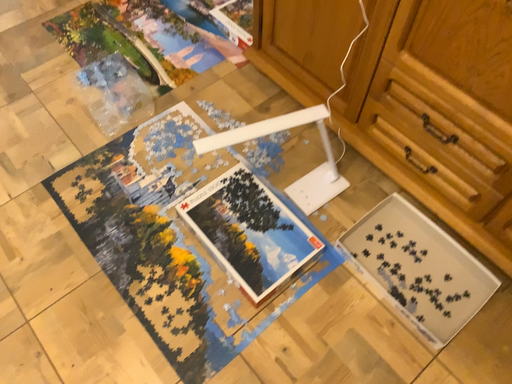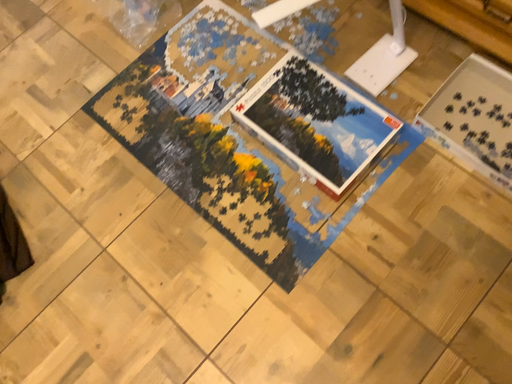
Question: Which way did the camera rotate in the video?

Choices:
 (A) rotated upward
 (B) rotated downward

Answer: (B)